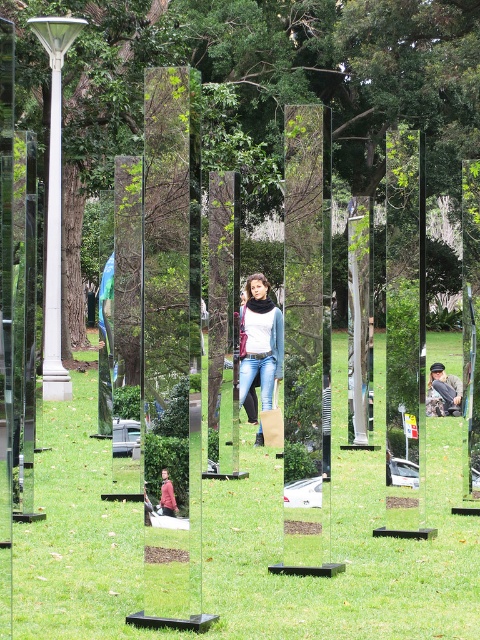
Question: In this image, where is green leafy tree at center located relative to red fabric jacket at center?

Choices:
 (A) left
 (B) right

Answer: (A)

Question: Which of the following is the closest to the observer?

Choices:
 (A) red fabric jacket at center
 (B) matte black scarf at center

Answer: (A)

Question: Among these points, which one is nearest to the camera?

Choices:
 (A) click(244, 177)
 (B) click(259, 360)

Answer: (B)

Question: Is green grass at center positioned at the back of matte black scarf at center?

Choices:
 (A) no
 (B) yes

Answer: (A)

Question: Among these objects, which one is farthest from the camera?

Choices:
 (A) green grass at center
 (B) matte black scarf at center
 (C) camouflage fabric jacket at center

Answer: (C)

Question: Is green grass at center to the right of matte black scarf at center from the viewer's perspective?

Choices:
 (A) no
 (B) yes

Answer: (A)